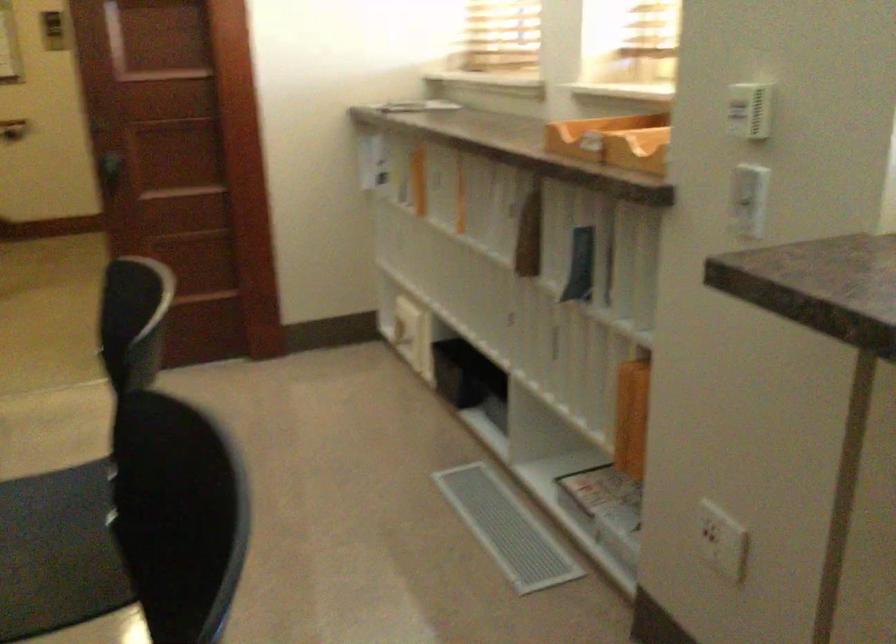
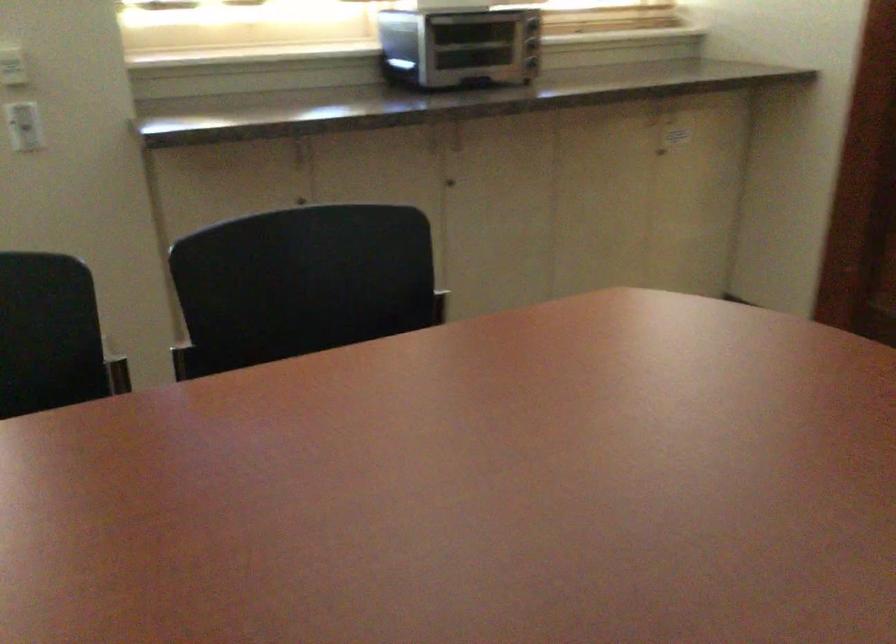
In the second image, find the point that corresponds to point (728, 202) in the first image.

(24, 126)